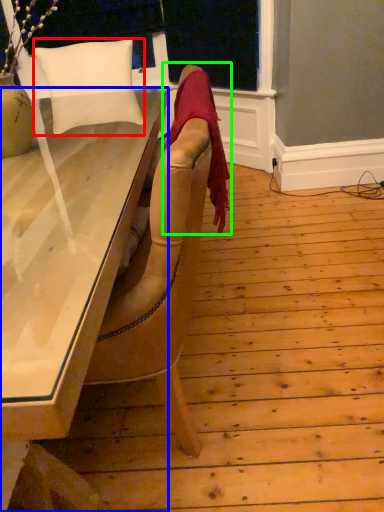
Question: Considering the real-world distances, which object is closest to pillow (highlighted by a red box)? desk (highlighted by a blue box) or blanket (highlighted by a green box).

Choices:
 (A) desk
 (B) blanket

Answer: (A)